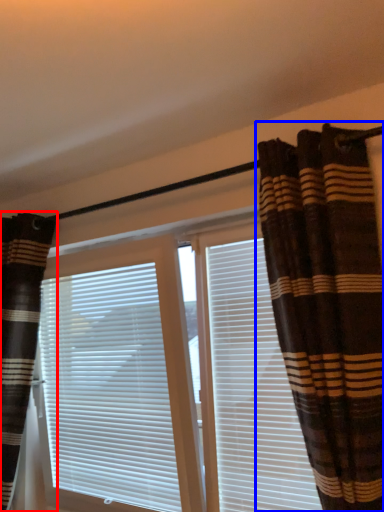
Question: Which of the following is the closest to the observer, curtain (highlighted by a red box) or curtain (highlighted by a blue box)?

Choices:
 (A) curtain
 (B) curtain

Answer: (B)